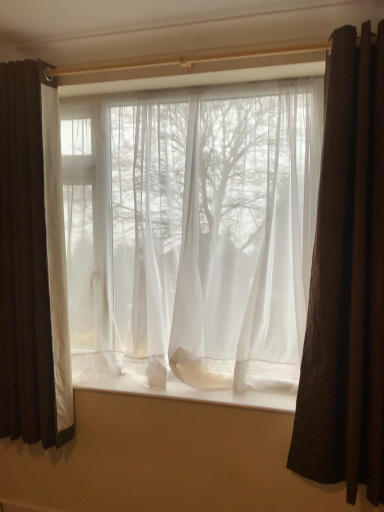
Question: From a real-world perspective, is matte white curtain at left, the 3th curtain positioned from the right, positioned over brown velvet curtain at right, positioned as the third curtain in left-to-right order, based on gravity?

Choices:
 (A) no
 (B) yes

Answer: (B)

Question: Is matte white curtain at left, positioned as the first curtain in left-to-right order, positioned with its back to brown velvet curtain at right, positioned as the third curtain in left-to-right order?

Choices:
 (A) yes
 (B) no

Answer: (B)

Question: Is matte white curtain at left, positioned as the first curtain in left-to-right order, thinner than brown velvet curtain at right, which is counted as the first curtain, starting from the right?

Choices:
 (A) yes
 (B) no

Answer: (A)

Question: Can you confirm if matte white curtain at left, the 3th curtain positioned from the right, is positioned to the right of brown velvet curtain at right, positioned as the third curtain in left-to-right order?

Choices:
 (A) no
 (B) yes

Answer: (A)

Question: Does matte white curtain at left, positioned as the first curtain in left-to-right order, have a greater width compared to brown velvet curtain at right, which is counted as the first curtain, starting from the right?

Choices:
 (A) yes
 (B) no

Answer: (B)

Question: In terms of width, does matte white curtain at left, the 3th curtain positioned from the right, look wider or thinner when compared to white sheer fabric at center?

Choices:
 (A) wide
 (B) thin

Answer: (B)

Question: Is point pos(59,181) closer or farther from the camera than point pos(253,403)?

Choices:
 (A) farther
 (B) closer

Answer: (A)

Question: Considering the positions of matte white curtain at left, the 3th curtain positioned from the right, and white sheer fabric at center in the image, is matte white curtain at left, the 3th curtain positioned from the right, taller or shorter than white sheer fabric at center?

Choices:
 (A) tall
 (B) short

Answer: (A)

Question: Relative to white sheer fabric at center, is matte white curtain at left, the 3th curtain positioned from the right, in front or behind?

Choices:
 (A) front
 (B) behind

Answer: (B)

Question: From a real-world perspective, relative to brown velvet curtain at right, which is counted as the first curtain, starting from the right, is matte white curtain at left, positioned as the first curtain in left-to-right order, vertically above or below?

Choices:
 (A) below
 (B) above

Answer: (B)

Question: Is point (64, 281) positioned closer to the camera than point (345, 222)?

Choices:
 (A) farther
 (B) closer

Answer: (A)

Question: Choose the correct answer: Is matte white curtain at left, positioned as the first curtain in left-to-right order, inside brown velvet curtain at right, which is counted as the first curtain, starting from the right, or outside it?

Choices:
 (A) inside
 (B) outside

Answer: (B)

Question: Visually, is matte white curtain at left, the 3th curtain positioned from the right, positioned to the left or to the right of brown velvet curtain at right, positioned as the third curtain in left-to-right order?

Choices:
 (A) right
 (B) left

Answer: (B)

Question: From the image's perspective, relative to sheer white curtain at center, which ranks as the 2th curtain in left-to-right order, is white sheer fabric at center above or below?

Choices:
 (A) below
 (B) above

Answer: (A)

Question: From a real-world perspective, is white sheer fabric at center positioned above or below sheer white curtain at center, placed as the second curtain when sorted from right to left?

Choices:
 (A) above
 (B) below

Answer: (B)